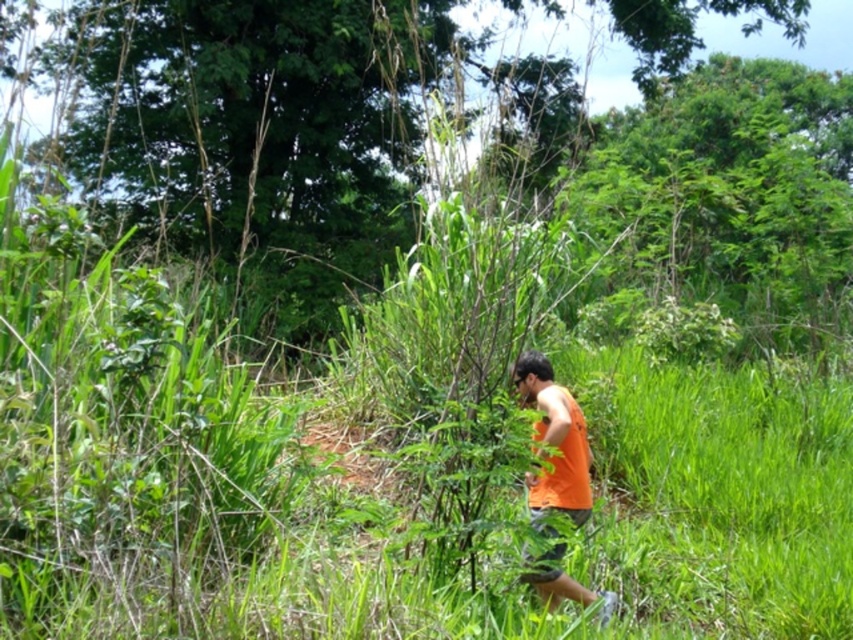
Question: Which object appears farthest from the camera in this image?

Choices:
 (A) green leafy tree at center
 (B) orange fabric shirt at center

Answer: (A)

Question: Among these points, which one is nearest to the camera?

Choices:
 (A) tap(71, 51)
 (B) tap(525, 364)

Answer: (B)

Question: Does green leafy tree at center have a smaller size compared to orange fabric shirt at center?

Choices:
 (A) no
 (B) yes

Answer: (A)

Question: Can you confirm if green leafy tree at center is positioned above orange fabric shirt at center?

Choices:
 (A) no
 (B) yes

Answer: (B)

Question: Does green leafy tree at center appear on the left side of orange fabric shirt at center?

Choices:
 (A) yes
 (B) no

Answer: (A)